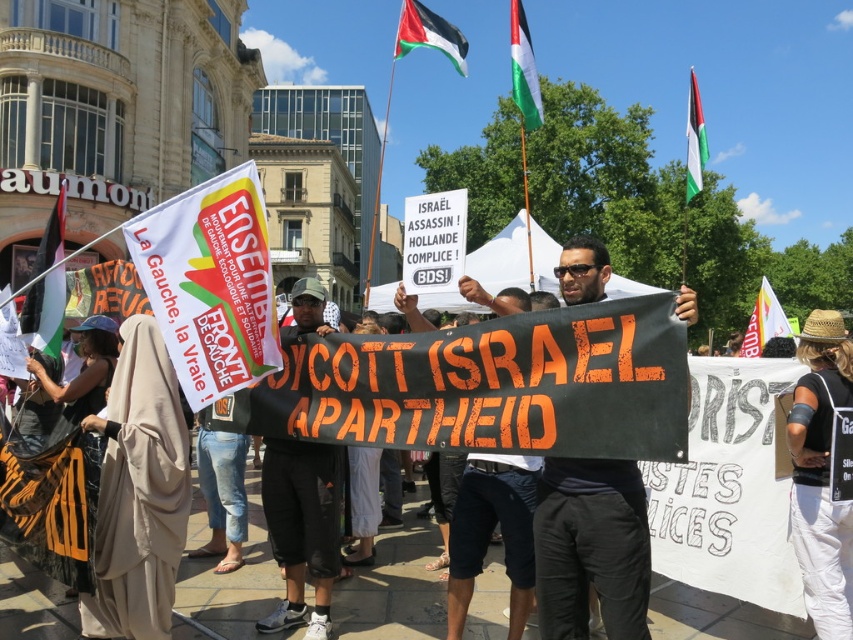
Who is more distant from viewer, (123, 403) or (459, 54)?

Positioned behind is point (459, 54).

Does point (155, 508) lie behind point (409, 4)?

No, (155, 508) is closer to viewer.

You are a GUI agent. You are given a task and a screenshot of the screen. Output one action in this format:
    pyautogui.click(x=<x>, y=<y>)
    Task: Click on the beige fabric headscarf at lower left
    The width and height of the screenshot is (853, 640).
    Given the screenshot: What is the action you would take?
    pyautogui.click(x=138, y=492)

Which is more to the left, beige fabric headscarf at lower left or palestinian flag at upper right?

beige fabric headscarf at lower left is more to the left.

From the picture: Is beige fabric headscarf at lower left further to the viewer compared to palestinian flag at upper right?

That is False.

Is point (105, 480) positioned after point (692, 152)?

That is False.

Locate an element on the screen. beige fabric headscarf at lower left is located at coordinates (x=138, y=492).

Measure the distance between point (177, 556) and camera.

Point (177, 556) is 15.08 meters from camera.

Between beige fabric headscarf at lower left and green and white fabric flag at upper center, which one is positioned higher?

green and white fabric flag at upper center is above.

What do you see at coordinates (138, 492) in the screenshot? Image resolution: width=853 pixels, height=640 pixels. I see `beige fabric headscarf at lower left` at bounding box center [138, 492].

The height and width of the screenshot is (640, 853). I want to click on beige fabric headscarf at lower left, so click(138, 492).